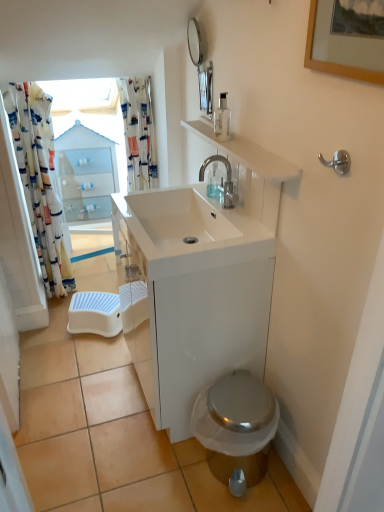
Question: Can you confirm if white glossy cabinet at upper center is shorter than white glossy sink at center?

Choices:
 (A) no
 (B) yes

Answer: (A)

Question: Does white glossy cabinet at upper center appear on the right side of white glossy sink at center?

Choices:
 (A) no
 (B) yes

Answer: (A)

Question: Is white glossy cabinet at upper center to the left of white glossy sink at center from the viewer's perspective?

Choices:
 (A) no
 (B) yes

Answer: (B)

Question: Can you confirm if white glossy cabinet at upper center is thinner than white glossy sink at center?

Choices:
 (A) yes
 (B) no

Answer: (A)

Question: Can white glossy sink at center be found inside white glossy cabinet at upper center?

Choices:
 (A) no
 (B) yes

Answer: (A)

Question: From a real-world perspective, does white glossy cabinet at upper center sit lower than white glossy sink at center?

Choices:
 (A) yes
 (B) no

Answer: (A)

Question: Considering the relative positions of shiny metallic toilet at lower right and white plastic step stool at lower left in the image provided, is shiny metallic toilet at lower right to the left of white plastic step stool at lower left from the viewer's perspective?

Choices:
 (A) no
 (B) yes

Answer: (A)

Question: Does shiny metallic toilet at lower right have a larger size compared to white plastic step stool at lower left?

Choices:
 (A) no
 (B) yes

Answer: (B)

Question: Is the depth of shiny metallic toilet at lower right greater than that of white plastic step stool at lower left?

Choices:
 (A) no
 (B) yes

Answer: (A)

Question: Considering the relative sizes of shiny metallic toilet at lower right and white plastic step stool at lower left in the image provided, is shiny metallic toilet at lower right shorter than white plastic step stool at lower left?

Choices:
 (A) yes
 (B) no

Answer: (B)

Question: Is shiny metallic toilet at lower right positioned beyond the bounds of white plastic step stool at lower left?

Choices:
 (A) yes
 (B) no

Answer: (A)

Question: Does shiny metallic toilet at lower right have a smaller size compared to white plastic step stool at lower left?

Choices:
 (A) no
 (B) yes

Answer: (A)

Question: From a real-world perspective, is white printed fabric shower curtain at left, positioned as the second shower curtain in right-to-left order, positioned under white glossy cabinet at upper center based on gravity?

Choices:
 (A) yes
 (B) no

Answer: (B)